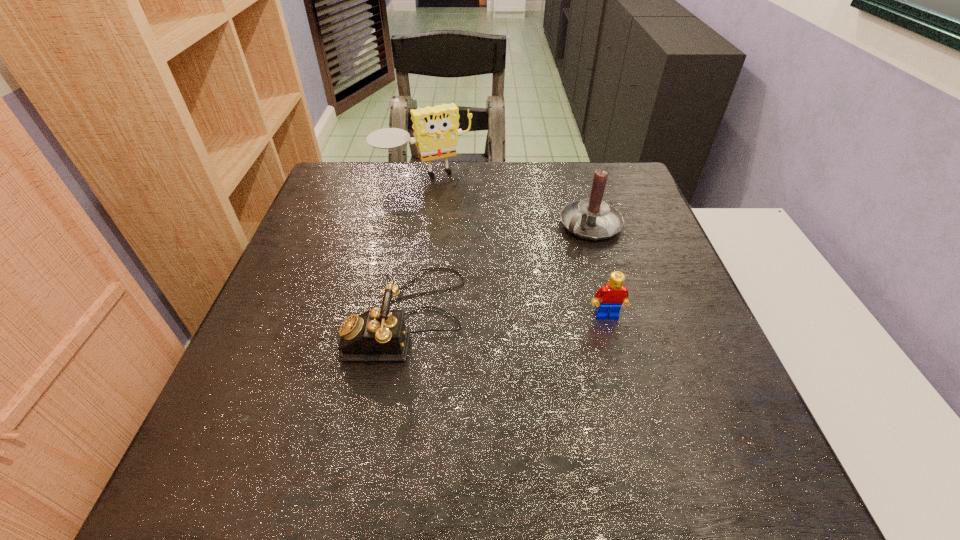
At what (x,y) coordinates should I click in order to perform the action: click on vacant space located 0.140m on the side of the second tallest object with the handle loop. Please return your answer as a coordinate pair (x, y). Image resolution: width=960 pixels, height=540 pixels. Looking at the image, I should click on (539, 268).

Image resolution: width=960 pixels, height=540 pixels. I want to click on vacant region located on the side of the second tallest object with the handle loop, so click(x=511, y=292).

Locate an element on the screen. The height and width of the screenshot is (540, 960). vacant region located on the side of the second tallest object with the handle loop is located at coordinates (464, 332).

Where is `free space located on the front-facing side of the farthest object`? free space located on the front-facing side of the farthest object is located at coordinates pos(478,253).

Find the location of a particular element. This screenshot has width=960, height=540. vacant position located on the front-facing side of the farthest object is located at coordinates (470, 241).

Where is `free space located on the front-facing side of the farthest object`? The image size is (960, 540). free space located on the front-facing side of the farthest object is located at coordinates coord(492,275).

Locate an element on the screen. The height and width of the screenshot is (540, 960). candle located at the far edge is located at coordinates (594, 219).

Image resolution: width=960 pixels, height=540 pixels. In order to click on sponge that is positioned at the far edge in this screenshot , I will do `click(436, 132)`.

Locate an element on the screen. The image size is (960, 540). object present at the left edge is located at coordinates (436, 132).

Where is `Lego located in the right edge section of the desktop`? The height and width of the screenshot is (540, 960). Lego located in the right edge section of the desktop is located at coordinates (613, 295).